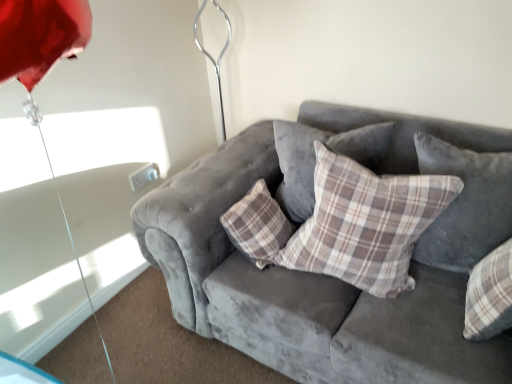
Question: In terms of width, does plaid fabric pillow at center, the second pillow positioned from the left, look wider or thinner when compared to plaid fabric pillow at center, positioned as the 1th pillow in left-to-right order?

Choices:
 (A) thin
 (B) wide

Answer: (B)

Question: From a real-world perspective, is plaid fabric pillow at center, the second pillow positioned from the left, physically located above or below plaid fabric pillow at center, positioned as the third pillow in right-to-left order?

Choices:
 (A) above
 (B) below

Answer: (A)

Question: Which is farther from the plaid fabric pillow at center, the 2th pillow from the right?

Choices:
 (A) white plastic electric outlet at lower left
 (B) plaid fabric pillow at center, which is counted as the 1th pillow, starting from the right
 (C) velvet gray couch at center
 (D) plaid fabric pillow at center, positioned as the third pillow in right-to-left order
 (E) metallic silver umbrella at upper center

Answer: (A)

Question: Which object is positioned closest to the plaid fabric pillow at center, positioned as the third pillow in right-to-left order?

Choices:
 (A) plaid fabric pillow at center, arranged as the 3th pillow when viewed from the left
 (B) plaid fabric pillow at center, the 2th pillow from the right
 (C) white plastic electric outlet at lower left
 (D) velvet gray couch at center
 (E) metallic silver umbrella at upper center

Answer: (B)